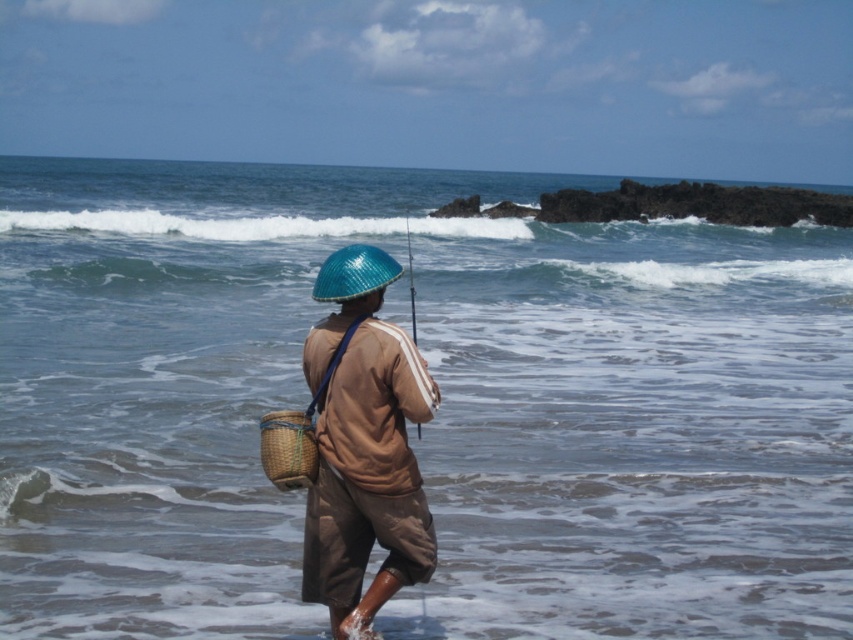
Is brown woven basket at center positioned in front of woven brown basket at lower left?

That is True.

Between point (428, 400) and point (294, 460), which one is positioned in front?

Point (428, 400)

Is point (381, 477) behind point (271, 476)?

No, (381, 477) is in front of (271, 476).

This screenshot has height=640, width=853. I want to click on brown woven basket at center, so click(364, 445).